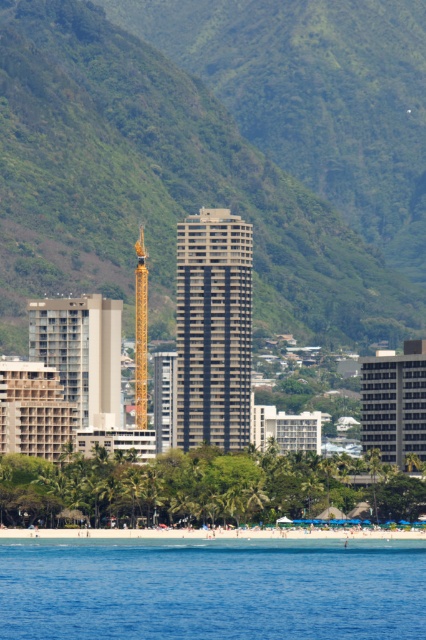
Who is lower down, blue liquid water at lower center or white sand beach at lower center?

blue liquid water at lower center is lower down.

Does blue liquid water at lower center have a lesser height compared to white sand beach at lower center?

Incorrect, blue liquid water at lower center's height does not fall short of white sand beach at lower center's.

Is point (143, 604) less distant than point (75, 536)?

Yes.

Where is `blue liquid water at lower center`? This screenshot has width=426, height=640. blue liquid water at lower center is located at coordinates (212, 588).

Which is below, blue liquid water at lower center or gold metallic crane at center?

blue liquid water at lower center is lower down.

Does blue liquid water at lower center have a greater width compared to gold metallic crane at center?

Yes, blue liquid water at lower center is wider than gold metallic crane at center.

The height and width of the screenshot is (640, 426). What do you see at coordinates (212, 588) in the screenshot?
I see `blue liquid water at lower center` at bounding box center [212, 588].

Image resolution: width=426 pixels, height=640 pixels. In order to click on blue liquid water at lower center in this screenshot , I will do 212,588.

Can you confirm if white sand beach at lower center is bigger than gold metallic crane at center?

Correct, white sand beach at lower center is larger in size than gold metallic crane at center.

Which is behind, point (31, 536) or point (143, 266)?

The point (31, 536) is more distant.

Measure the distance between point (x=336, y=532) and camera.

Point (x=336, y=532) is 2156.49 feet away from camera.

Where is `white sand beach at lower center`? Image resolution: width=426 pixels, height=640 pixels. white sand beach at lower center is located at coordinates click(x=218, y=532).